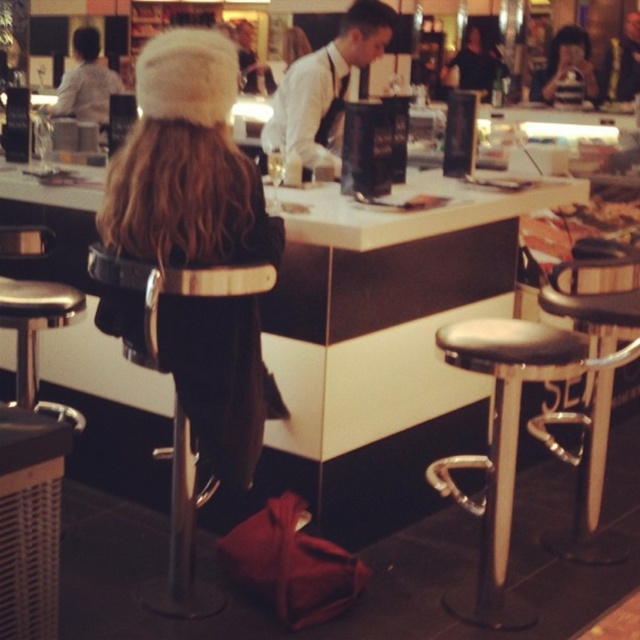
Does point (150, 131) lie behind point (317, 132)?

No, it is not.

From the picture: Does white fur hat at upper left come in front of white shirt at center?

That is True.

Is point (193, 257) less distant than point (340, 128)?

That is True.

This screenshot has width=640, height=640. Find the location of `white fur hat at upper left`. white fur hat at upper left is located at coordinates (186, 164).

Which is behind, point (148, 115) or point (592, 70)?

Point (592, 70)

Does white fur hat at upper left appear under striped fabric shirt at upper right?

Correct, white fur hat at upper left is located below striped fabric shirt at upper right.

Does point (192, 168) lie behind point (586, 54)?

No, (192, 168) is closer to viewer.

This screenshot has width=640, height=640. What are the coordinates of `white fur hat at upper left` in the screenshot? It's located at (186, 164).

Can you confirm if black leather bar stool at right is shorter than black leather stool at right?

Correct, black leather bar stool at right is not as tall as black leather stool at right.

Which of these two, black leather bar stool at right or black leather stool at right, stands shorter?

With less height is black leather bar stool at right.

Is point (560, 337) less distant than point (600, 320)?

Yes, it is in front of point (600, 320).

The height and width of the screenshot is (640, 640). Find the location of `black leather bar stool at right`. black leather bar stool at right is located at coordinates (499, 448).